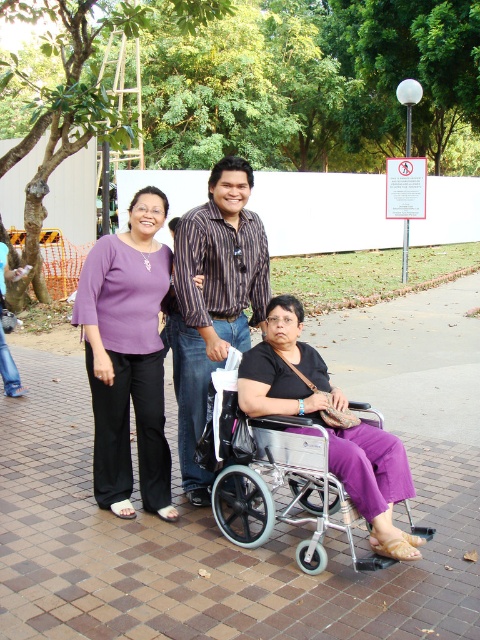
Question: In this image, where is purple fabric shirt at upper left located relative to silver metallic wheelchair at lower center?

Choices:
 (A) below
 (B) above

Answer: (B)

Question: Which object is positioned farthest from the purple fabric shirt at upper left?

Choices:
 (A) striped fabric shirt at center
 (B) silver metallic wheelchair at lower center
 (C) purple matte pants at center

Answer: (C)

Question: Which point is closer to the camera taking this photo?

Choices:
 (A) (156, 484)
 (B) (257, 244)
 (C) (311, 499)

Answer: (A)

Question: Which point is closer to the camera taking this photo?

Choices:
 (A) (149, 284)
 (B) (252, 260)
 (C) (313, 550)

Answer: (C)

Question: Does purple matte pants at center appear under striped fabric shirt at center?

Choices:
 (A) yes
 (B) no

Answer: (A)

Question: Does purple fabric shirt at upper left appear over striped fabric shirt at center?

Choices:
 (A) no
 (B) yes

Answer: (A)